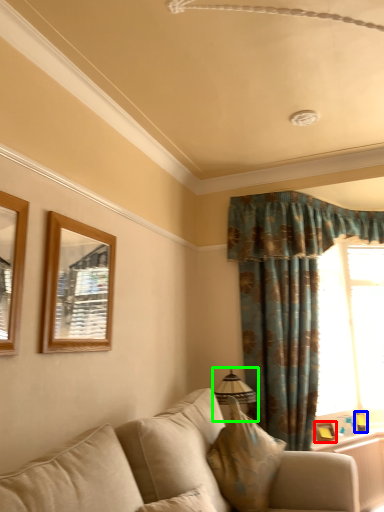
Question: Considering the real-world distances, which object is farthest from picture frame (highlighted by a red box)? picture frame (highlighted by a blue box) or lamp (highlighted by a green box)?

Choices:
 (A) picture frame
 (B) lamp

Answer: (B)